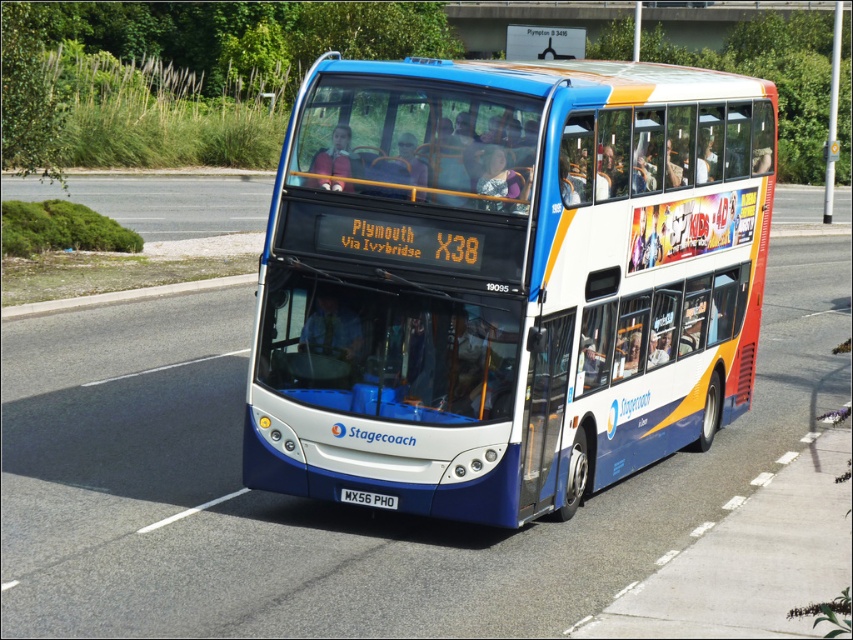
Between blue metallic bus at center and white plastic license plate at center, which one appears on the left side from the viewer's perspective?

white plastic license plate at center is more to the left.

Consider the image. Between blue metallic bus at center and white plastic license plate at center, which one appears on the right side from the viewer's perspective?

From the viewer's perspective, blue metallic bus at center appears more on the right side.

Image resolution: width=853 pixels, height=640 pixels. What are the coordinates of `blue metallic bus at center` in the screenshot? It's located at (505, 280).

Where is `blue metallic bus at center`? The width and height of the screenshot is (853, 640). blue metallic bus at center is located at coordinates (505, 280).